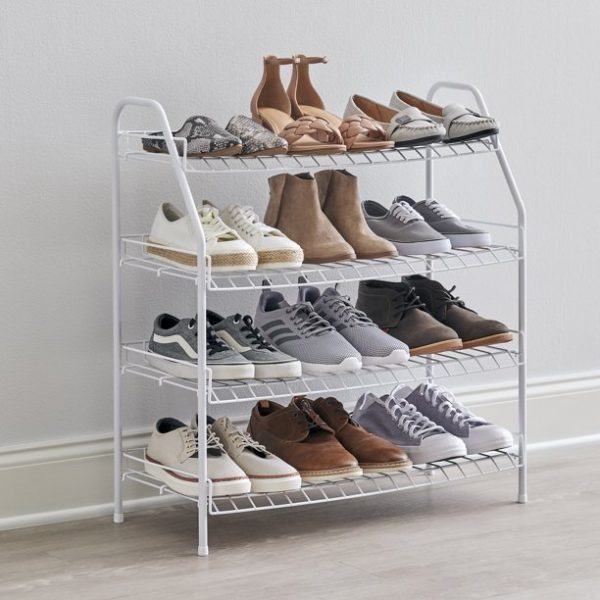
The height and width of the screenshot is (600, 600). In order to click on shelves in this screenshot , I will do `click(395, 479)`, `click(395, 375)`, `click(397, 267)`, `click(387, 153)`.